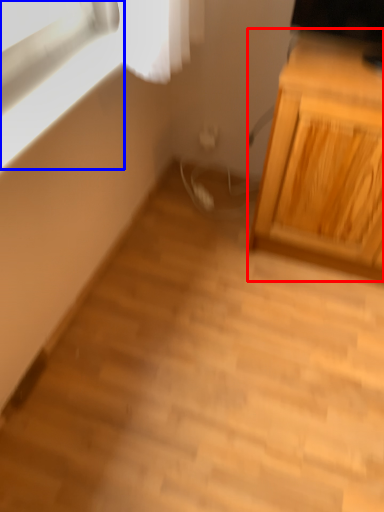
Question: Which object is closer to the camera taking this photo, cabinetry (highlighted by a red box) or window (highlighted by a blue box)?

Choices:
 (A) cabinetry
 (B) window

Answer: (B)